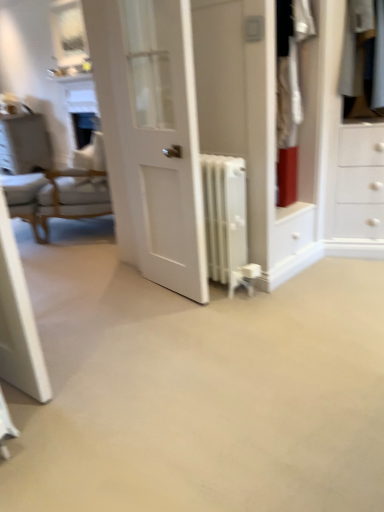
Question: Is white glossy door at center spatially inside white metallic radiator at center, or outside of it?

Choices:
 (A) inside
 (B) outside

Answer: (B)

Question: In terms of height, does white glossy door at center look taller or shorter compared to white metallic radiator at center?

Choices:
 (A) short
 (B) tall

Answer: (B)

Question: Which object is positioned closest to the white metallic radiator at center?

Choices:
 (A) white cotton shirt at upper right
 (B) white fabric chair at left
 (C) white glossy vanity at upper left
 (D) white glossy door at center
 (E) light brown wooden armchair at left

Answer: (D)

Question: Which of these objects is positioned farthest from the white cotton shirt at upper right?

Choices:
 (A) white metallic radiator at center
 (B) light brown wooden armchair at left
 (C) white fabric chair at left
 (D) white glossy vanity at upper left
 (E) white glossy door at center

Answer: (D)